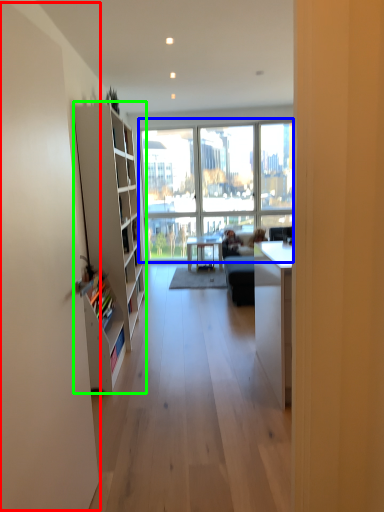
Question: Which object is positioned closest to screen door (highlighted by a red box)? Select from window (highlighted by a blue box) and cabinet (highlighted by a green box).

Choices:
 (A) window
 (B) cabinet

Answer: (B)